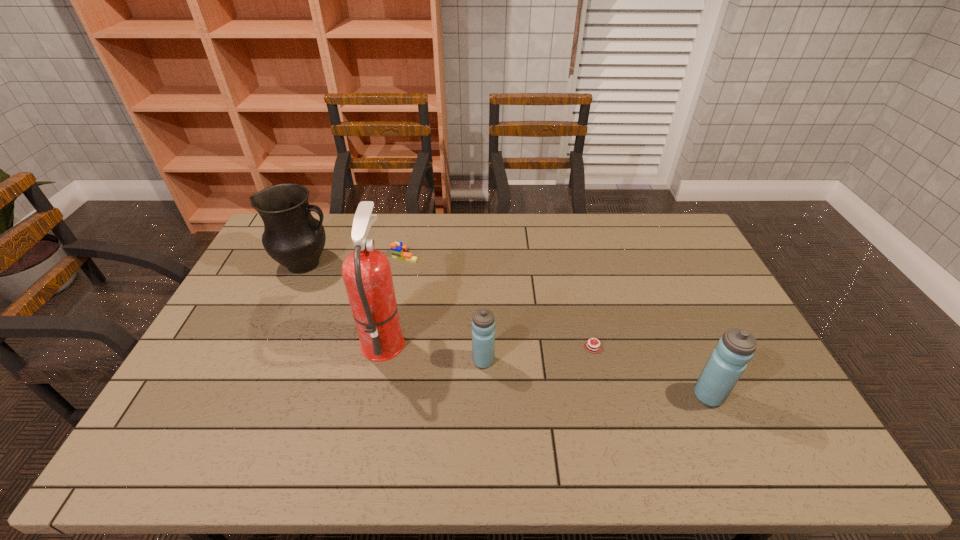
The image size is (960, 540). Find the location of `empty space that is in between the leftmost object and the shortest object`. empty space that is in between the leftmost object and the shortest object is located at coordinates (449, 306).

Locate an element on the screen. The height and width of the screenshot is (540, 960). empty location between the rightmost object and the second shortest object is located at coordinates (557, 326).

This screenshot has width=960, height=540. In order to click on free space between the fire extinguisher and the leftmost object in this screenshot , I will do `click(345, 302)`.

Find the location of a particular element. This screenshot has height=540, width=960. blank region between the fire extinguisher and the third object from right to left is located at coordinates (434, 350).

You are a GUI agent. You are given a task and a screenshot of the screen. Output one action in this format:
    pyautogui.click(x=<x>, y=<y>)
    Task: Click on the free area in between the Lego and the third object from right to left
    
    Given the screenshot: What is the action you would take?
    444,308

Image resolution: width=960 pixels, height=540 pixels. Find the location of `the second closest object relative to the third object from right to left`. the second closest object relative to the third object from right to left is located at coordinates (591, 346).

Where is `object that ranks as the third closest to the tallest object`? The image size is (960, 540). object that ranks as the third closest to the tallest object is located at coordinates (398, 250).

Locate an element on the screen. The width and height of the screenshot is (960, 540). free location that satisfies the following two spatial constraints: 1. on the handle side of the fourth object from left to right; 2. on the right side of the pitcher is located at coordinates (262, 361).

In order to click on free spot that satisfies the following two spatial constraints: 1. on the handle side of the pitcher; 2. on the right side of the nearer water bottle in this screenshot , I will do `click(246, 396)`.

Where is `free region that satisfies the following two spatial constraints: 1. with the handle and hose on the fire extinguisher; 2. on the back side of the right water bottle`? free region that satisfies the following two spatial constraints: 1. with the handle and hose on the fire extinguisher; 2. on the back side of the right water bottle is located at coordinates (372, 396).